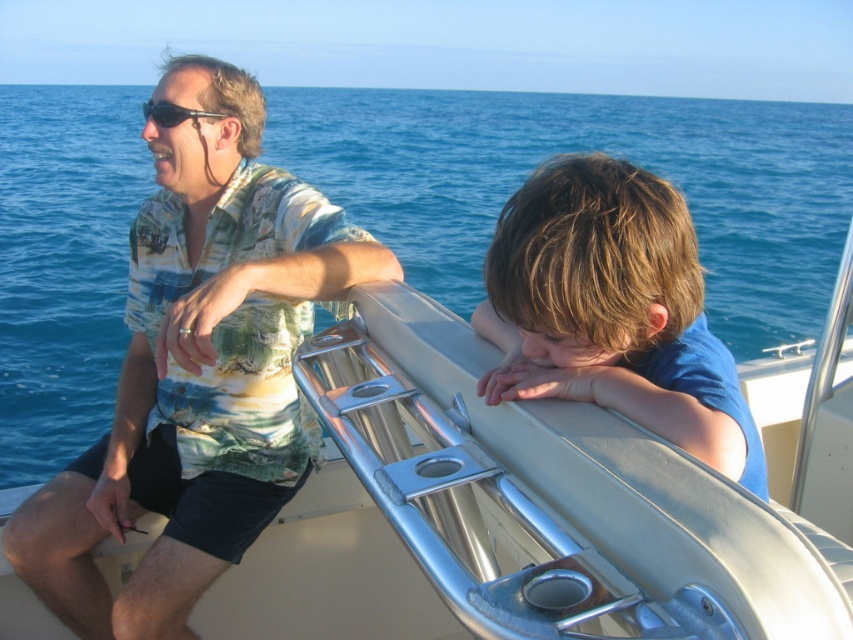
Question: Estimate the real-world distances between objects in this image. Which object is closer to the printed fabric shirt at upper left?

Choices:
 (A) matte black sunglasses at upper left
 (B) blue matte shirt at right
 (C) blue water at upper center

Answer: (A)

Question: Among these points, which one is nearest to the camera?

Choices:
 (A) (674, 301)
 (B) (157, 102)
 (C) (248, 376)
 (D) (457, 189)

Answer: (A)

Question: Is blue water at upper center below blue matte shirt at right?

Choices:
 (A) yes
 (B) no

Answer: (B)

Question: Where is printed fabric shirt at upper left located in relation to blue matte shirt at right in the image?

Choices:
 (A) left
 (B) right

Answer: (A)

Question: Which of the following is the closest to the observer?

Choices:
 (A) blue matte shirt at right
 (B) printed fabric shirt at upper left

Answer: (A)

Question: Does blue water at upper center appear over blue matte shirt at right?

Choices:
 (A) no
 (B) yes

Answer: (B)